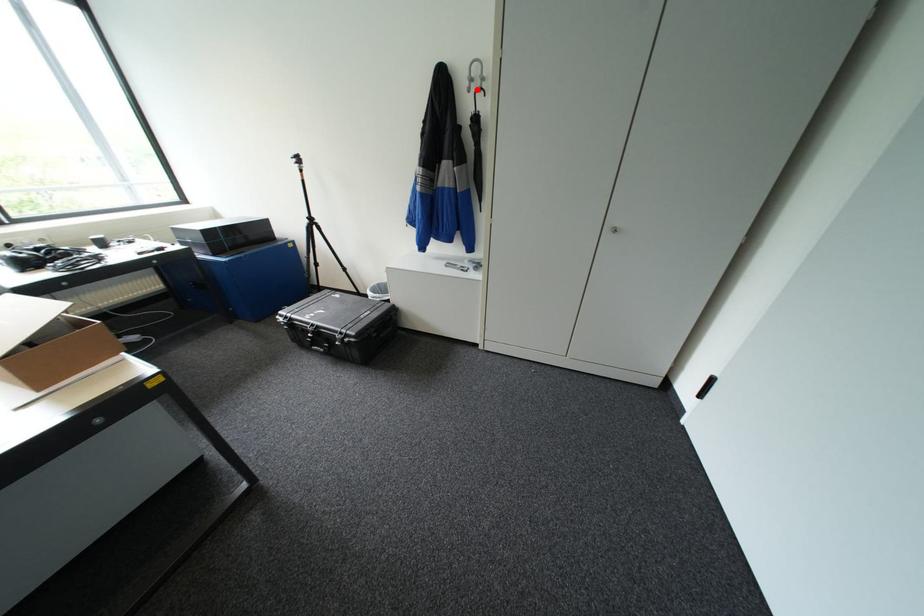
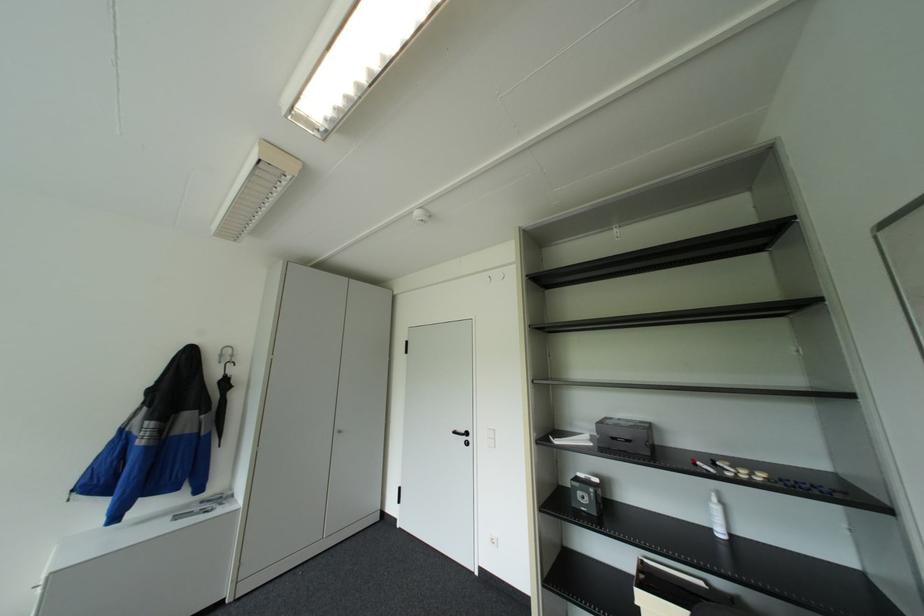
In the second image, find the point that corresponds to the highlighted location in the first image.

(227, 361)